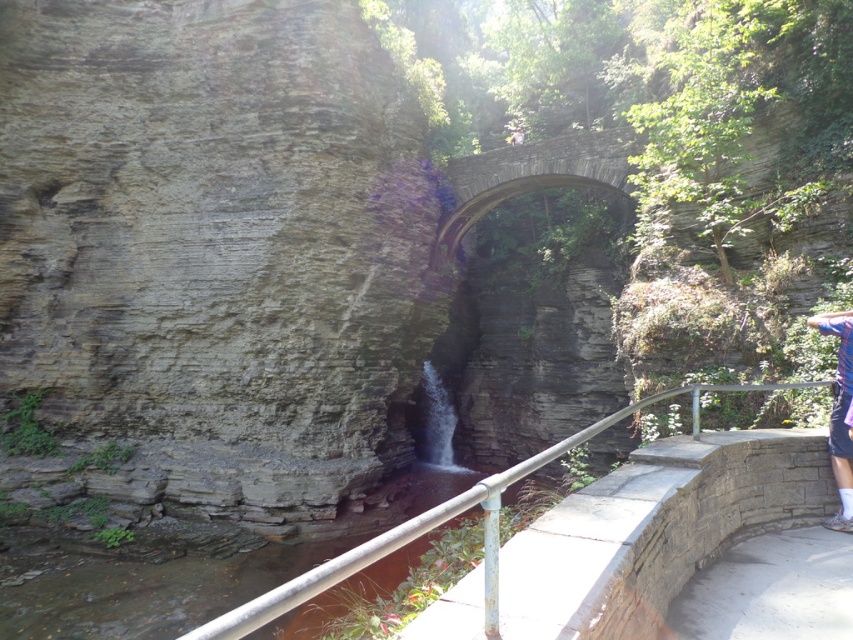
Is point (297, 604) positioned before point (833, 419)?

Yes, it is in front of point (833, 419).

Is point (351, 552) positioned behind point (849, 368)?

Yes, it is behind point (849, 368).

Is point (370, 550) more distant than point (844, 362)?

No, (370, 550) is closer to viewer.

Locate an element on the screen. metallic gray rail at lower center is located at coordinates (432, 522).

Between stone arch bridge at center and metallic gray rail at lower center, which one has less height?

Standing shorter between the two is stone arch bridge at center.

Does point (589, 161) come closer to viewer compared to point (252, 627)?

That is False.

Is point (558, 172) farther from camera compared to point (239, 618)?

Yes.

The image size is (853, 640). Identify the location of stone arch bridge at center. (531, 177).

Who is taller, stone arch bridge at center or blue striped shirt at right?

With more height is stone arch bridge at center.

Is stone arch bridge at center above blue striped shirt at right?

Indeed, stone arch bridge at center is positioned over blue striped shirt at right.

Where is `stone arch bridge at center`? The image size is (853, 640). stone arch bridge at center is located at coordinates (531, 177).